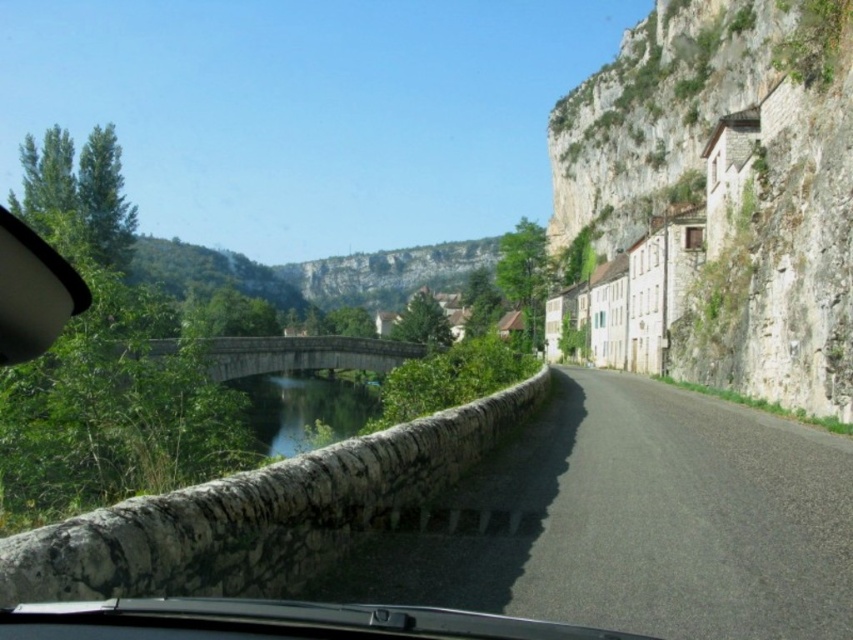
Question: Can you confirm if white stone houses at right is positioned to the right of transparent plastic car window at upper left?

Choices:
 (A) yes
 (B) no

Answer: (A)

Question: Which point is farther to the camera?

Choices:
 (A) (775, 605)
 (B) (282, 380)
 (C) (74, 284)
 (D) (608, 120)

Answer: (D)

Question: Which point is closer to the camera taking this photo?

Choices:
 (A) (315, 355)
 (B) (271, 385)

Answer: (A)

Question: Observing the image, what is the correct spatial positioning of asphalt road at center in reference to clear water at bridge center?

Choices:
 (A) above
 (B) below

Answer: (A)

Question: Can you confirm if transparent plastic car window at upper left is positioned above stone bridge at center?

Choices:
 (A) yes
 (B) no

Answer: (A)

Question: Which of these objects is positioned farthest from the white stone houses at right?

Choices:
 (A) asphalt road at center
 (B) transparent plastic car window at upper left
 (C) clear water at bridge center
 (D) stone bridge at center

Answer: (B)